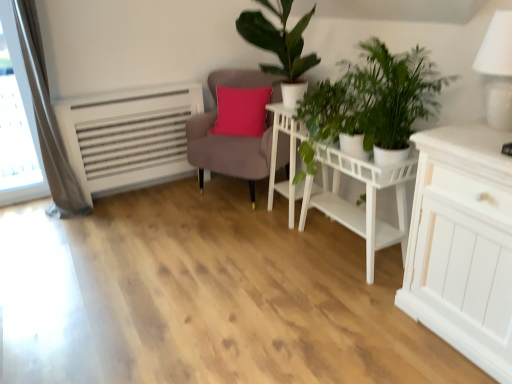
The width and height of the screenshot is (512, 384). In order to click on vacant space situated on the left part of white matte table at center in this screenshot , I will do `click(279, 268)`.